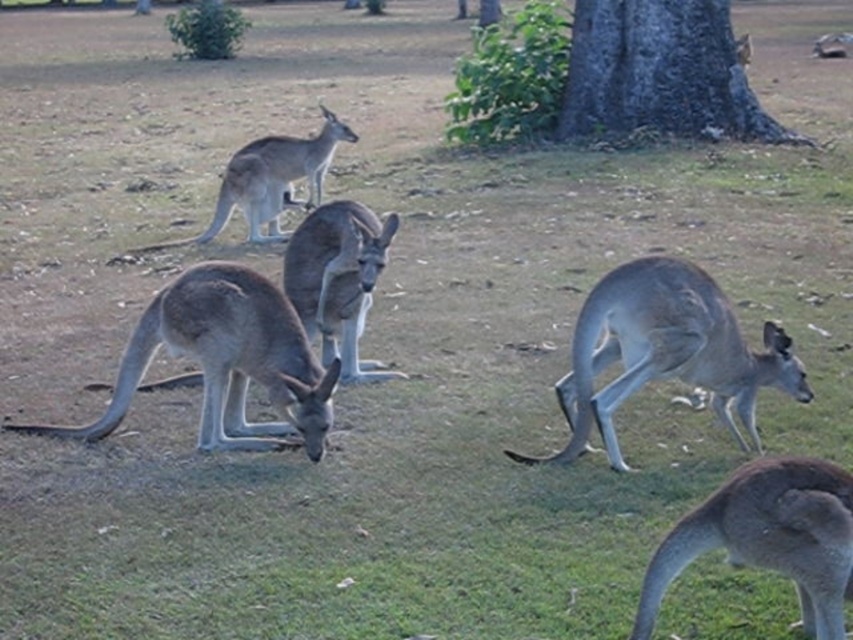
Between gray matte kangaroo at center and gray matte kangaroo at lower left, which one appears on the right side from the viewer's perspective?

gray matte kangaroo at center

What do you see at coordinates (665, 352) in the screenshot? I see `gray matte kangaroo at center` at bounding box center [665, 352].

The image size is (853, 640). What are the coordinates of `gray matte kangaroo at center` in the screenshot? It's located at click(665, 352).

Consider the image. Who is positioned more to the right, brown fur kangaroo at center or gray matte kangaroo at upper center?

From the viewer's perspective, brown fur kangaroo at center appears more on the right side.

Does brown fur kangaroo at center have a greater width compared to gray matte kangaroo at upper center?

In fact, brown fur kangaroo at center might be narrower than gray matte kangaroo at upper center.

Where is `brown fur kangaroo at center`? brown fur kangaroo at center is located at coordinates (338, 280).

Image resolution: width=853 pixels, height=640 pixels. In order to click on brown fur kangaroo at center in this screenshot , I will do `click(338, 280)`.

Who is more forward, (816,474) or (347,332)?

Point (816,474)

Who is higher up, brown fur at lower right or brown fur kangaroo at center?

Positioned higher is brown fur kangaroo at center.

Where is `brown fur at lower right`? This screenshot has height=640, width=853. brown fur at lower right is located at coordinates (769, 538).

Where is `brown fur at lower right`? The image size is (853, 640). brown fur at lower right is located at coordinates (769, 538).